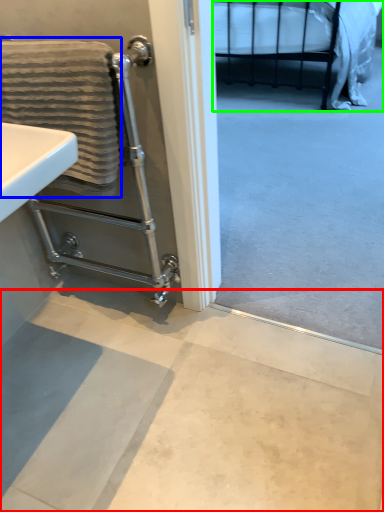
Question: Considering the real-world distances, which object is farthest from concrete (highlighted by a red box)? bath towel (highlighted by a blue box) or bed (highlighted by a green box)?

Choices:
 (A) bath towel
 (B) bed

Answer: (B)